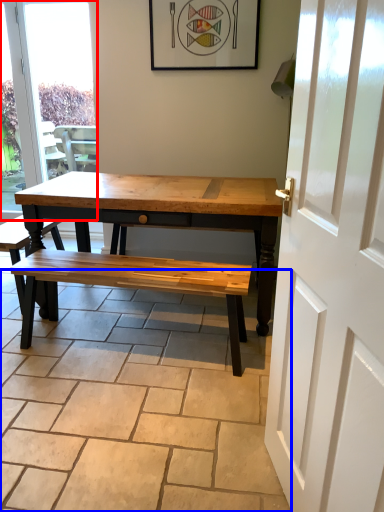
Question: Which point is further to the camera, window (highlighted by a red box) or path (highlighted by a blue box)?

Choices:
 (A) window
 (B) path

Answer: (A)